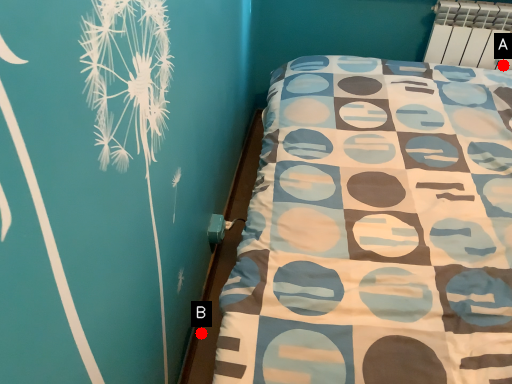
Question: Two points are circled on the image, labeled by A and B beside each circle. Which point appears closest to the camera in this image?

Choices:
 (A) A is closer
 (B) B is closer

Answer: (B)